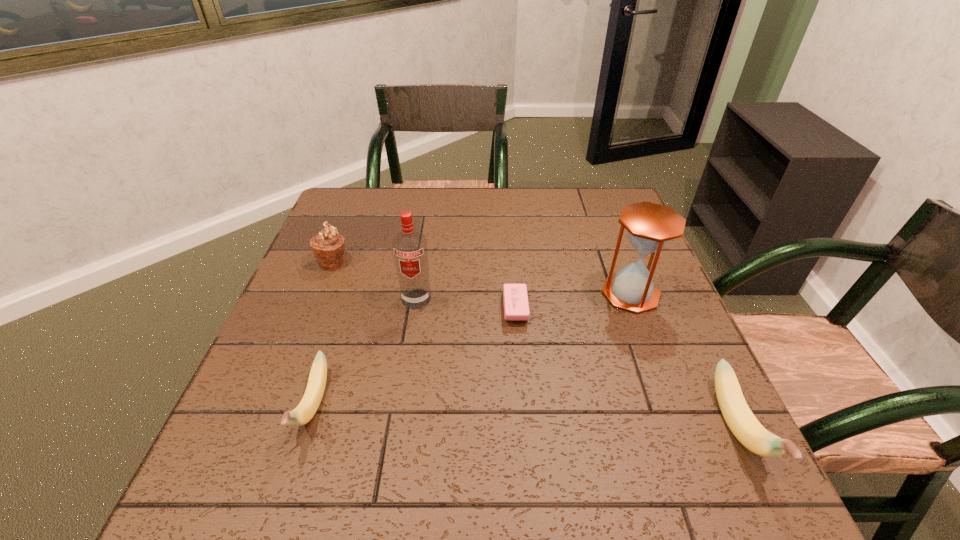
Find the location of a particular element. free region at the far edge of the desktop is located at coordinates (456, 195).

Find the location of a particular element. This screenshot has width=960, height=540. free region at the near edge of the desktop is located at coordinates (491, 448).

Locate an element on the screen. The width and height of the screenshot is (960, 540). vacant space at the left edge of the desktop is located at coordinates (305, 348).

You are a GUI agent. You are given a task and a screenshot of the screen. Output one action in this format:
    pyautogui.click(x=<x>, y=<y>)
    Task: Click on the free space at the right edge
    The height and width of the screenshot is (540, 960).
    Given the screenshot: What is the action you would take?
    pyautogui.click(x=663, y=352)

Where is `blank area at the far left corner`? The height and width of the screenshot is (540, 960). blank area at the far left corner is located at coordinates (340, 203).

In the image, there is a desktop. Identify the location of vacant space at the far right corner. This screenshot has width=960, height=540. (605, 214).

In the image, there is a desktop. Identify the location of vacant space at the near right corner. (664, 442).

Identify the location of vacant space that is in between the shorter banana and the leftmost object. (323, 334).

What are the coordinates of `empty space between the vodka and the rightmost object` in the screenshot? It's located at (577, 363).

Image resolution: width=960 pixels, height=540 pixels. What are the coordinates of `free point between the shortest object and the hourglass` in the screenshot? It's located at (573, 301).